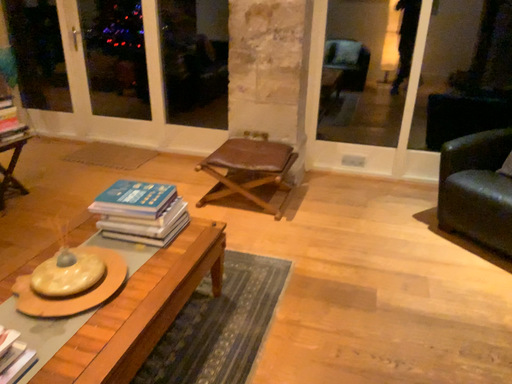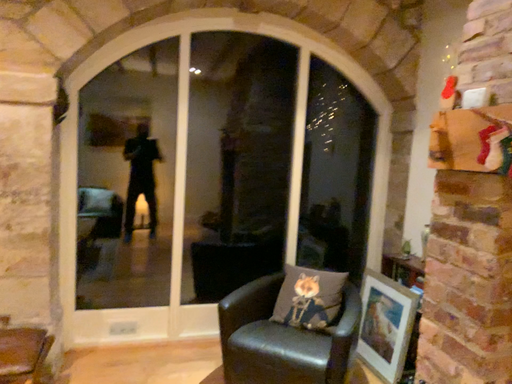
Question: Which way did the camera rotate in the video?

Choices:
 (A) rotated right
 (B) rotated left

Answer: (A)